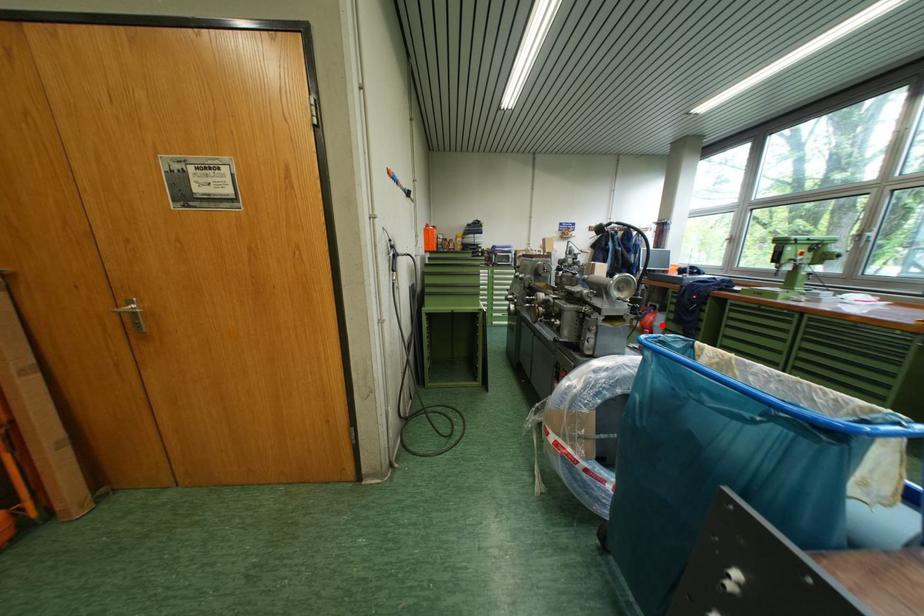
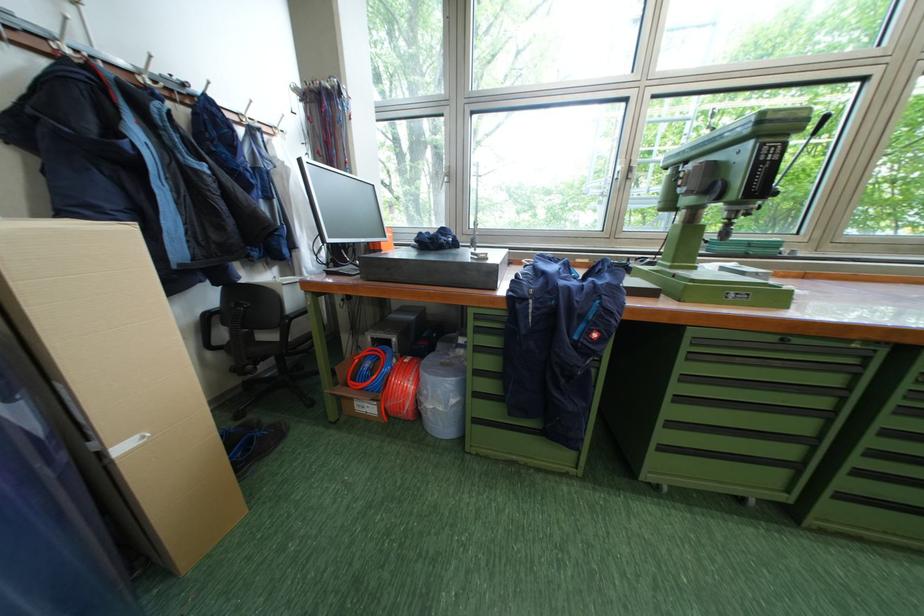
Question: A red point is marked in image1. In image2, is the corresponding 3D point closer to the camera or farther? Reply with the corresponding letter.

Choices:
 (A) The corresponding 3D point is closer.
 (B) The corresponding 3D point is farther.

Answer: (A)